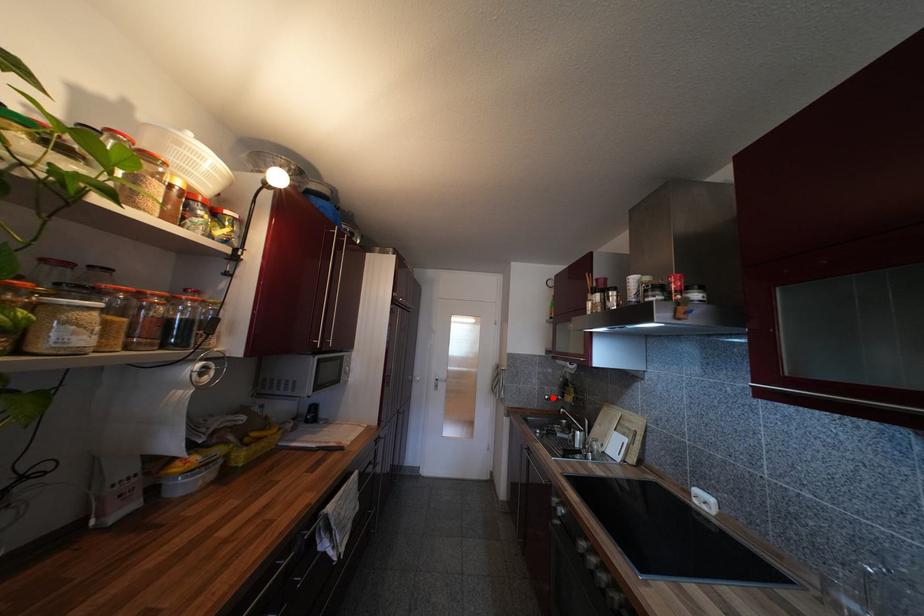
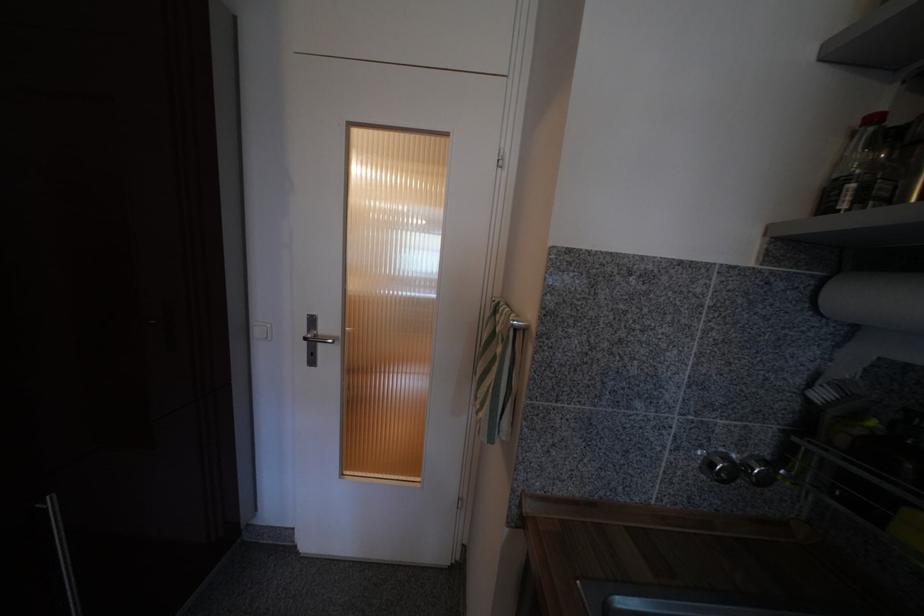
Question: I am providing you with two images of the same scene from different viewpoints. A red point is shown in image1. For the corresponding object point in image2, is it positioned nearer or farther from the camera?

Choices:
 (A) Nearer
 (B) Farther

Answer: (A)